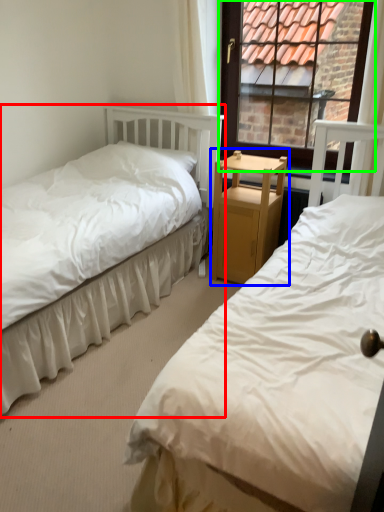
Question: Which object is the farthest from bed (highlighted by a red box)? Choose among these: nightstand (highlighted by a blue box) or window (highlighted by a green box).

Choices:
 (A) nightstand
 (B) window

Answer: (B)